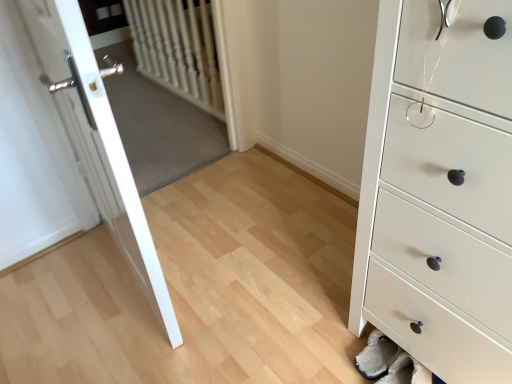
Where is `free space in front of white glossy door at left`? The height and width of the screenshot is (384, 512). free space in front of white glossy door at left is located at coordinates (123, 336).